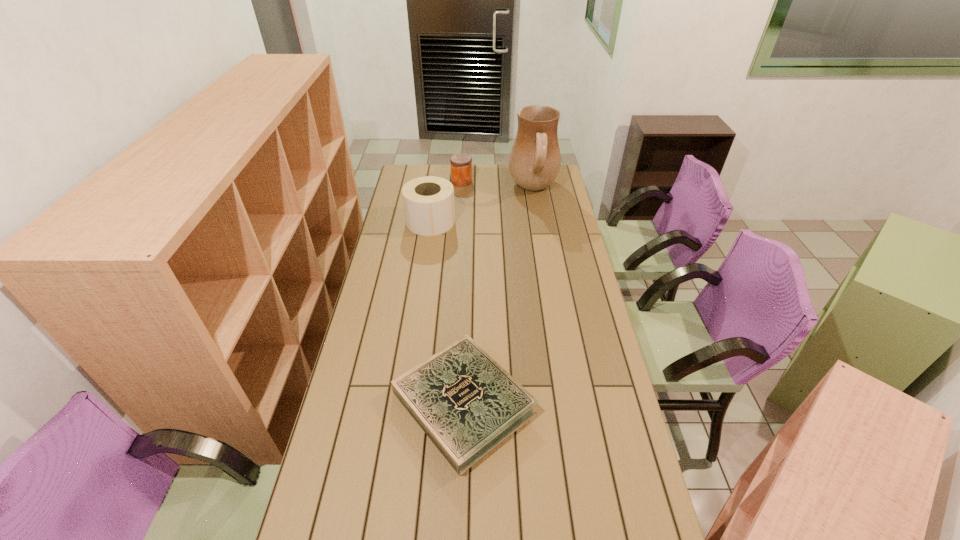
The image size is (960, 540). I want to click on free space located on the back of the hardback book, so click(467, 303).

Locate an element on the screen. The image size is (960, 540). cream pitcher at the far edge is located at coordinates (535, 159).

This screenshot has height=540, width=960. What are the coordinates of `jar that is at the far edge` in the screenshot? It's located at (461, 164).

At what (x,y) coordinates should I click in order to perform the action: click on object that is at the left edge. Please return your answer as a coordinate pair (x, y). Image resolution: width=960 pixels, height=540 pixels. Looking at the image, I should click on (428, 201).

Where is `object located at the right edge`? The height and width of the screenshot is (540, 960). object located at the right edge is located at coordinates (535, 159).

Where is `object present at the far right corner`? object present at the far right corner is located at coordinates (535, 159).

Where is `free region at the far edge`? The image size is (960, 540). free region at the far edge is located at coordinates (446, 180).

In the image, there is a desktop. Identify the location of free space at the left edge. The image size is (960, 540). (361, 469).

In the image, there is a desktop. Identify the location of vacant space at the right edge. This screenshot has width=960, height=540. (576, 399).

The height and width of the screenshot is (540, 960). Find the location of `vacant space at the far right corner of the desktop`. vacant space at the far right corner of the desktop is located at coordinates click(x=553, y=186).